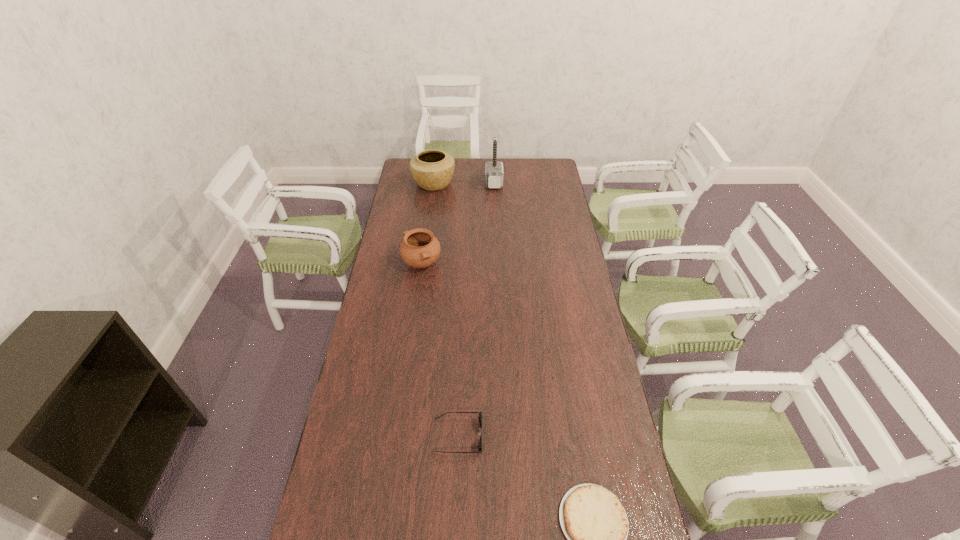
Locate an element on the screen. vacant region located 0.090m on the right of the third farthest object is located at coordinates (463, 264).

At what (x,y) coordinates should I click in order to perform the action: click on blank space located 0.160m on the front-facing side of the sunglasses. Please return your answer as a coordinate pair (x, y). This screenshot has height=540, width=960. Looking at the image, I should click on (535, 436).

Find the location of a particular element. The width and height of the screenshot is (960, 540). hammer present at the far edge is located at coordinates (494, 174).

This screenshot has width=960, height=540. I want to click on pottery that is positioned at the far edge, so click(x=432, y=170).

I want to click on object located at the far left corner, so click(432, 170).

The width and height of the screenshot is (960, 540). What are the coordinates of `free space at the far edge` in the screenshot? It's located at (516, 159).

Identify the location of free space at the left edge of the desktop. This screenshot has width=960, height=540. pos(385,417).

In the image, there is a desktop. Where is `vacant space at the right edge`? vacant space at the right edge is located at coordinates (591, 465).

I want to click on empty location between the farther pottery and the sunglasses, so click(x=445, y=309).

Identify the location of vacant area that lies between the sunglasses and the farther pottery. (445, 309).